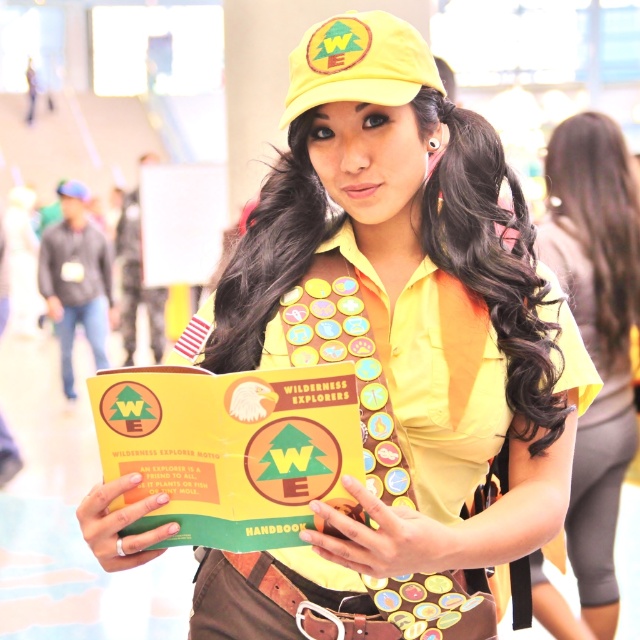
You are a Wilderness Explorer trying to determine which item is taller between the yellow matte shirt at center and the yellow fabric cap at upper center. Based on the scene description, which one is taller?

The yellow matte shirt at center is taller than the yellow fabric cap at upper center according to the description.